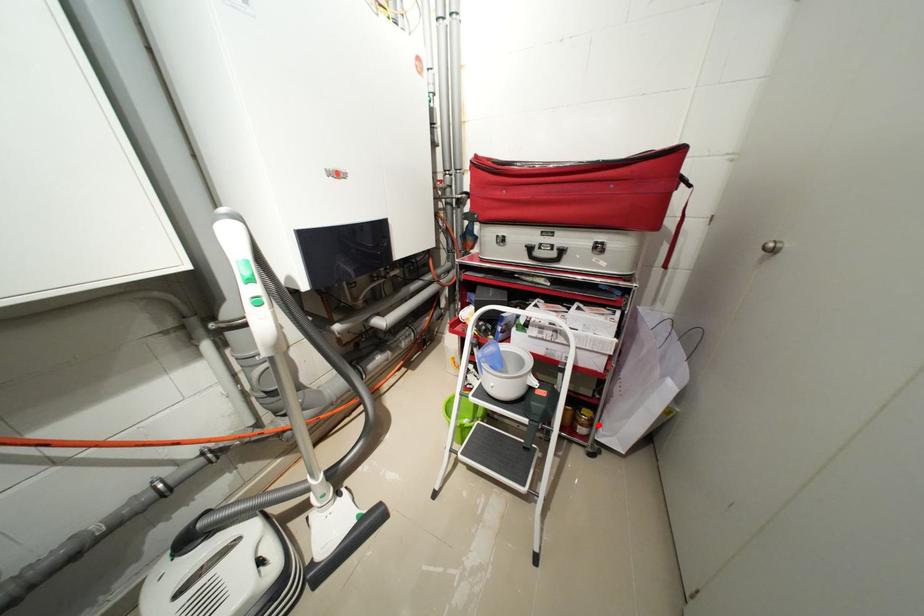
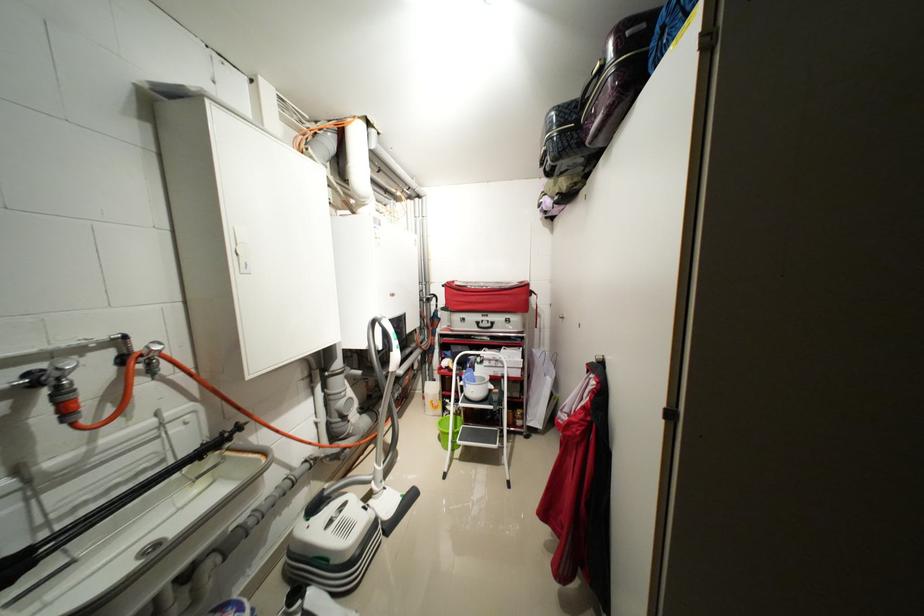
Question: I am providing you with two images of the same scene from different viewpoints. A red point is shown in image1. For the corresponding object point in image2, is it positioned nearer or farther from the camera?

Choices:
 (A) Nearer
 (B) Farther

Answer: (B)